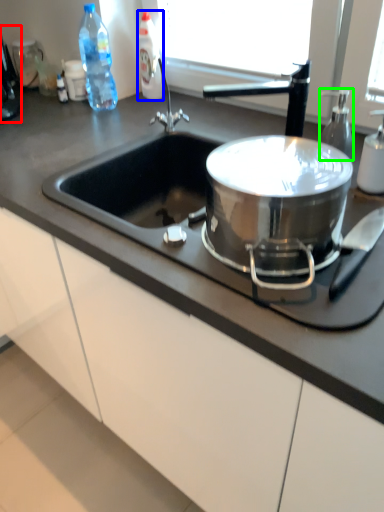
Question: Based on their relative distances, which object is farther from coffee machine (highlighted by a red box)? Choose from bottle (highlighted by a blue box) and soap dispenser (highlighted by a green box).

Choices:
 (A) bottle
 (B) soap dispenser

Answer: (B)